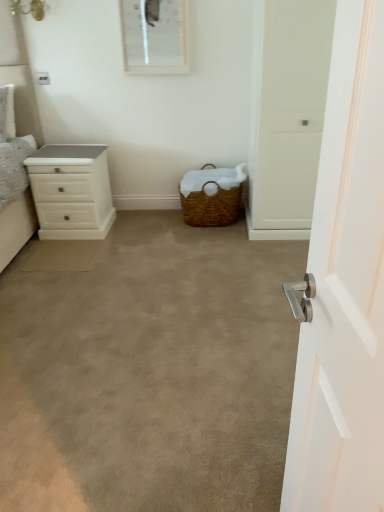
Question: Is beige carpet at center completely or partially inside white glossy chest of drawers at left?

Choices:
 (A) yes
 (B) no

Answer: (B)

Question: Is white glossy chest of drawers at left at the right side of beige carpet at center?

Choices:
 (A) no
 (B) yes

Answer: (A)

Question: Is white glossy chest of drawers at left beside beige carpet at center?

Choices:
 (A) yes
 (B) no

Answer: (B)

Question: Is there a large distance between white glossy chest of drawers at left and beige carpet at center?

Choices:
 (A) no
 (B) yes

Answer: (A)

Question: Considering the relative sizes of white glossy chest of drawers at left and beige carpet at center in the image provided, is white glossy chest of drawers at left wider than beige carpet at center?

Choices:
 (A) yes
 (B) no

Answer: (B)

Question: Does white glossy chest of drawers at left come in front of beige carpet at center?

Choices:
 (A) no
 (B) yes

Answer: (A)

Question: Is white glossy picture frame at upper center next to white glossy chest of drawers at left and touching it?

Choices:
 (A) no
 (B) yes

Answer: (A)

Question: From the image's perspective, is white glossy picture frame at upper center located beneath white glossy chest of drawers at left?

Choices:
 (A) no
 (B) yes

Answer: (A)

Question: Does white glossy picture frame at upper center have a lesser width compared to white glossy chest of drawers at left?

Choices:
 (A) no
 (B) yes

Answer: (B)

Question: Is there a large distance between white glossy picture frame at upper center and white glossy chest of drawers at left?

Choices:
 (A) yes
 (B) no

Answer: (B)

Question: Could you tell me if white glossy picture frame at upper center is turned towards white glossy chest of drawers at left?

Choices:
 (A) yes
 (B) no

Answer: (B)

Question: Does white glossy picture frame at upper center lie behind white glossy chest of drawers at left?

Choices:
 (A) no
 (B) yes

Answer: (B)

Question: From the image's perspective, is white glossy picture frame at upper center below woven brown picnic basket at center?

Choices:
 (A) yes
 (B) no

Answer: (B)